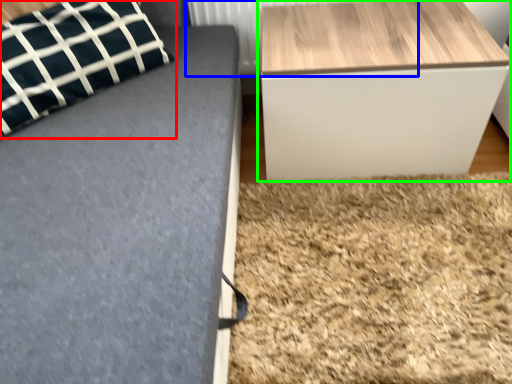
Question: Which is nearer to the pillow (highlighted by a red box)? radiator (highlighted by a blue box) or table (highlighted by a green box).

Choices:
 (A) radiator
 (B) table

Answer: (A)